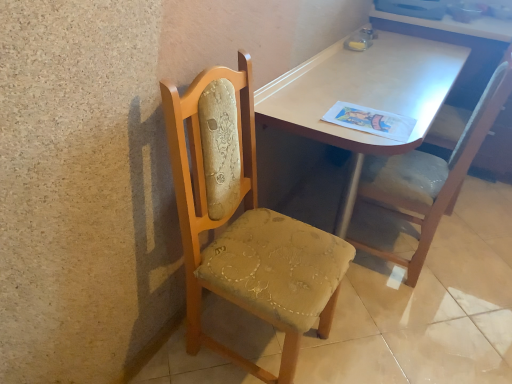
At what (x,y) coordinates should I click in order to perform the action: click on free spot in front of velvet upholstered chair at right, the first chair viewed from the right. Please return your answer as a coordinate pair (x, y). This screenshot has width=512, height=384. Looking at the image, I should click on (421, 327).